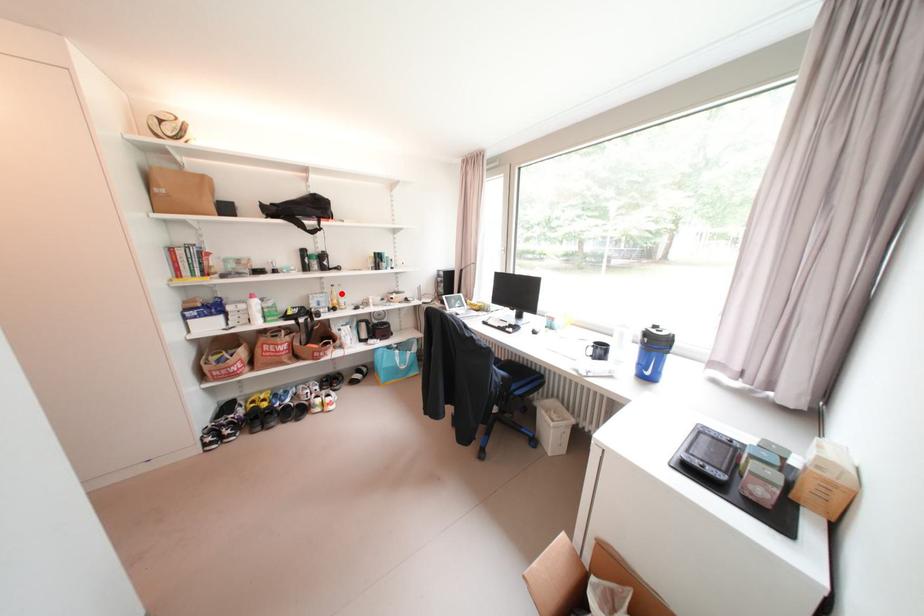
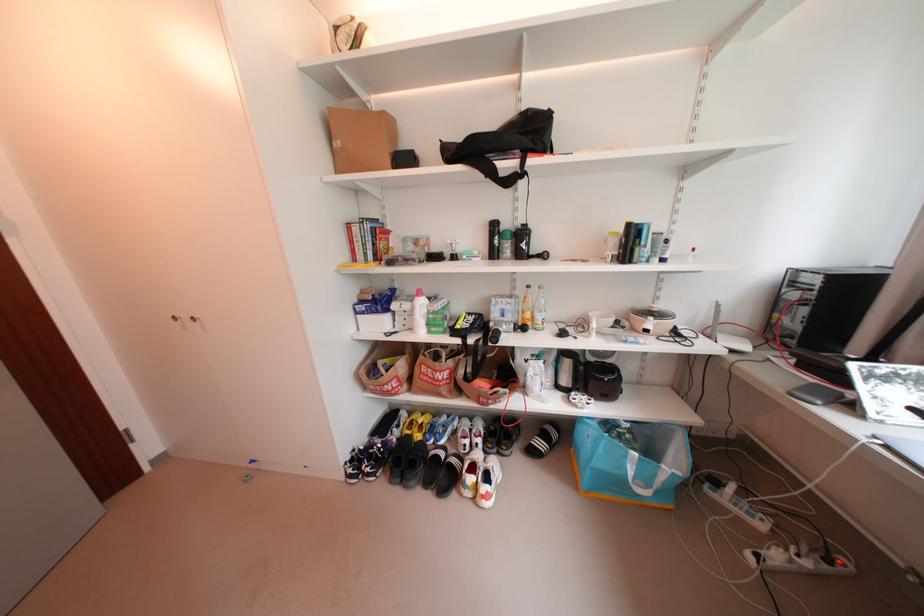
Find the pixel in the second image that matches the highlighted location in the first image.

(536, 301)